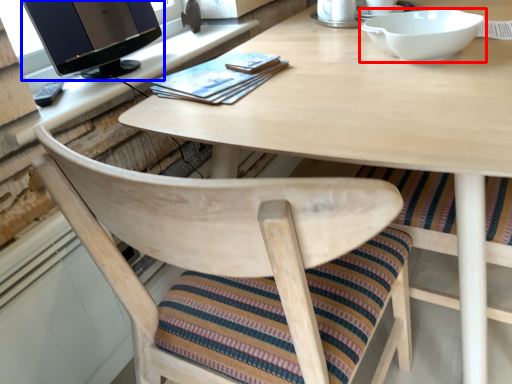
Question: Which point is closer to the camera, bowl (highlighted by a red box) or computer monitor (highlighted by a blue box)?

Choices:
 (A) bowl
 (B) computer monitor

Answer: (A)